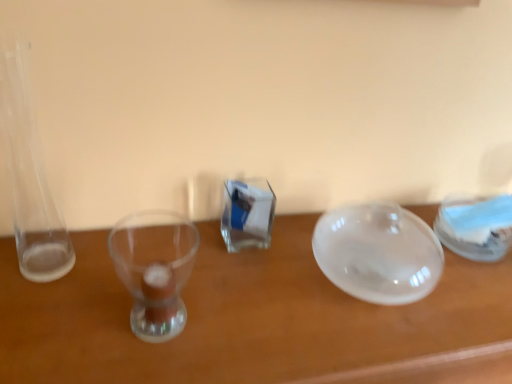
Measure the distance between point (478, 248) and camera.

Point (478, 248) and camera are 3.38 feet apart from each other.

Where is `transparent plastic container at right`? The height and width of the screenshot is (384, 512). transparent plastic container at right is located at coordinates (476, 226).

What is the approximate width of transparent plastic container at right?

transparent plastic container at right is 6.53 inches wide.

The image size is (512, 384). What do you see at coordinates (476, 226) in the screenshot?
I see `transparent plastic container at right` at bounding box center [476, 226].

What is the approximate height of transparent glass bowl at center?

The height of transparent glass bowl at center is 31.00 inches.

The height and width of the screenshot is (384, 512). Find the location of `transparent glass bowl at center`. transparent glass bowl at center is located at coordinates (254, 321).

Measure the distance between point (175, 367) and camera.

The distance of point (175, 367) from camera is 27.83 inches.

What do you see at coordinates (254, 321) in the screenshot?
I see `transparent glass bowl at center` at bounding box center [254, 321].

The image size is (512, 384). I want to click on transparent plastic container at right, so click(476, 226).

Consider the image. Considering the positions of objects transparent glass bowl at center and transparent plastic container at right in the image provided, who is more to the right, transparent glass bowl at center or transparent plastic container at right?

transparent plastic container at right is more to the right.

Which object is further away from the camera taking this photo, transparent glass bowl at center or transparent plastic container at right?

transparent plastic container at right is behind.

Considering the positions of point (492, 305) and point (443, 209), is point (492, 305) closer or farther from the camera than point (443, 209)?

Point (492, 305) appears to be closer to the viewer than point (443, 209).

From the image's perspective, which is below, transparent glass bowl at center or transparent plastic container at right?

transparent glass bowl at center appears lower in the image.

From a real-world perspective, who is located higher, transparent glass bowl at center or transparent plastic container at right?

transparent plastic container at right is physically above.

Which of these two, transparent glass bowl at center or transparent plastic container at right, is thinner?

Thinner between the two is transparent plastic container at right.

Based on the photo, is transparent glass bowl at center taller than transparent plastic container at right?

Yes.

Considering the relative sizes of transparent glass bowl at center and transparent plastic container at right in the image provided, is transparent glass bowl at center smaller than transparent plastic container at right?

Incorrect, transparent glass bowl at center is not smaller in size than transparent plastic container at right.

Is transparent glass bowl at center positioned beyond the bounds of transparent plastic container at right?

Yes.

Are transparent glass bowl at center and transparent plastic container at right located far from each other?

No, transparent glass bowl at center is not far away from transparent plastic container at right.

Is transparent glass bowl at center positioned with its back to transparent plastic container at right?

transparent glass bowl at center does not have its back to transparent plastic container at right.

Measure the distance from transparent glass bowl at center to transparent plastic container at right.

The distance of transparent glass bowl at center from transparent plastic container at right is 15.81 inches.

At what (x,y) coordinates should I click in order to perform the action: click on table that is under the transparent plastic container at right (from a real-world perspective). Please return your answer as a coordinate pair (x, y). The height and width of the screenshot is (384, 512). Looking at the image, I should click on (254, 321).

Is transparent plastic container at right at the right side of transparent glass bowl at center?

Indeed, transparent plastic container at right is positioned on the right side of transparent glass bowl at center.

Considering their positions, is transparent plastic container at right located in front of or behind transparent glass bowl at center?

Visually, transparent plastic container at right is located behind transparent glass bowl at center.

Considering the positions of point (508, 233) and point (270, 326), is point (508, 233) closer or farther from the camera than point (270, 326)?

Point (508, 233) is farther from the camera than point (270, 326).

From the image's perspective, between transparent plastic container at right and transparent glass bowl at center, who is located below?

transparent glass bowl at center.

From a real-world perspective, which is physically below, transparent plastic container at right or transparent glass bowl at center?

transparent glass bowl at center.

Can you confirm if transparent plastic container at right is thinner than transparent glass bowl at center?

Yes.

Considering the relative sizes of transparent plastic container at right and transparent glass bowl at center in the image provided, is transparent plastic container at right taller than transparent glass bowl at center?

No, transparent plastic container at right is not taller than transparent glass bowl at center.

Does transparent plastic container at right have a larger size compared to transparent glass bowl at center?

Incorrect, transparent plastic container at right is not larger than transparent glass bowl at center.

Is transparent plastic container at right surrounding transparent glass bowl at center?

No, transparent glass bowl at center is not surrounded by transparent plastic container at right.

Is transparent plastic container at right not close to transparent glass bowl at center?

No, transparent plastic container at right is not far from transparent glass bowl at center.

Based on the photo, could you tell me if transparent plastic container at right is turned towards transparent glass bowl at center?

No, transparent plastic container at right is not oriented towards transparent glass bowl at center.

Can you tell me how much transparent plastic container at right and transparent glass bowl at center differ in facing direction?

transparent plastic container at right and transparent glass bowl at center are facing 0.847 degrees away from each other.

At what (x,y) coordinates should I click in order to perform the action: click on table beneath the transparent plastic container at right (from a real-world perspective). Please return your answer as a coordinate pair (x, y). Image resolution: width=512 pixels, height=384 pixels. Looking at the image, I should click on (254, 321).

The width and height of the screenshot is (512, 384). I want to click on tableware on the right of transparent glass bowl at center, so click(x=476, y=226).

You are a GUI agent. You are given a task and a screenshot of the screen. Output one action in this format:
    pyautogui.click(x=<x>, y=<y>)
    Task: Click on the table that is under the transparent plastic container at right (from a real-world perspective)
    This screenshot has height=384, width=512.
    Given the screenshot: What is the action you would take?
    pyautogui.click(x=254, y=321)